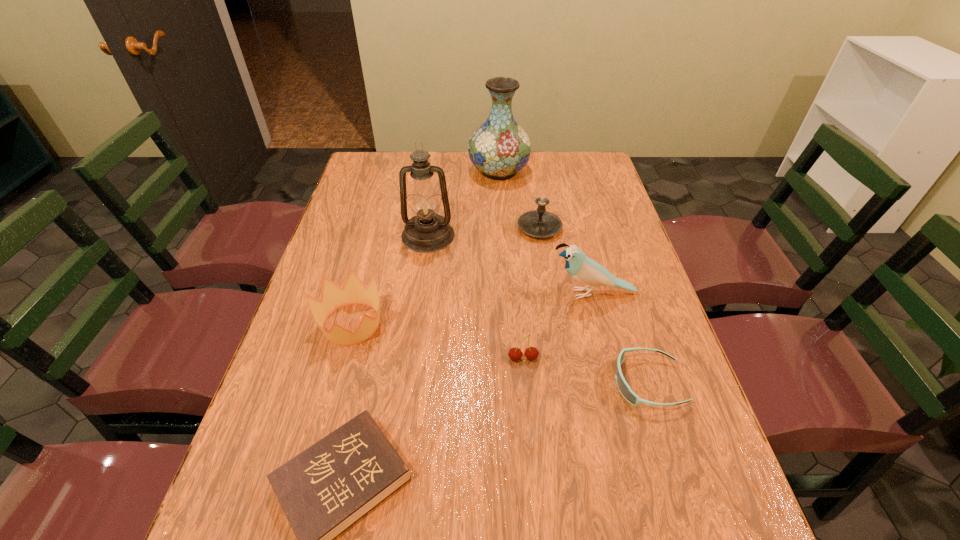
In order to click on vase in this screenshot , I will do `click(499, 148)`.

Locate an element on the screen. oil lamp is located at coordinates (427, 231).

This screenshot has height=540, width=960. Find the location of `the third tallest object`. the third tallest object is located at coordinates (583, 269).

Where is `the fifth shortest object`? The image size is (960, 540). the fifth shortest object is located at coordinates (540, 223).

Identify the location of crown. The image size is (960, 540). click(333, 297).

Where is `cherry`? This screenshot has width=960, height=540. cherry is located at coordinates (531, 353).

I want to click on goggles, so click(624, 388).

Locate an element on the screen. vacant space located on the left of the farthest object is located at coordinates (436, 171).

At what (x,y) coordinates should I click in order to perform the action: click on free spot located 0.110m on the right of the oil lamp. Please return your answer as a coordinate pair (x, y). This screenshot has width=960, height=540. Looking at the image, I should click on (492, 235).

Where is `free space located at the face of the bird`? Image resolution: width=960 pixels, height=540 pixels. free space located at the face of the bird is located at coordinates (416, 294).